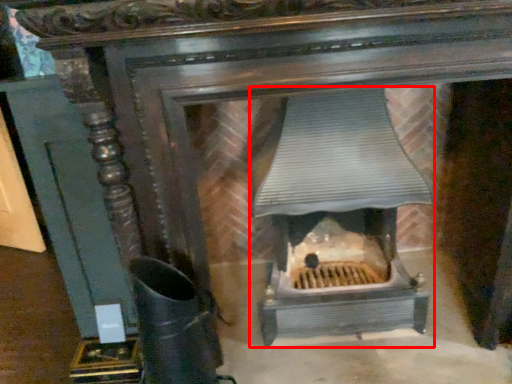
Question: From the image's perspective, what is the correct spatial positioning of heater (annotated by the red box) in reference to boot?

Choices:
 (A) below
 (B) above

Answer: (B)